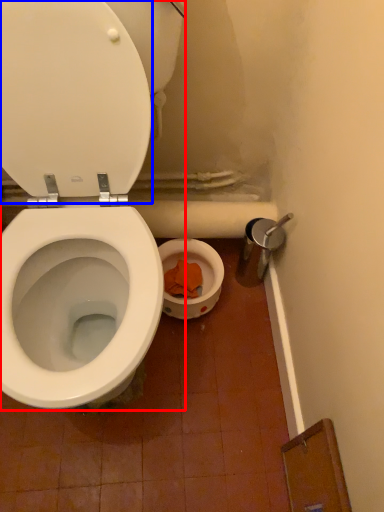
Question: Which object is closer to the camera taking this photo, toilet (highlighted by a red box) or lid (highlighted by a blue box)?

Choices:
 (A) toilet
 (B) lid

Answer: (A)